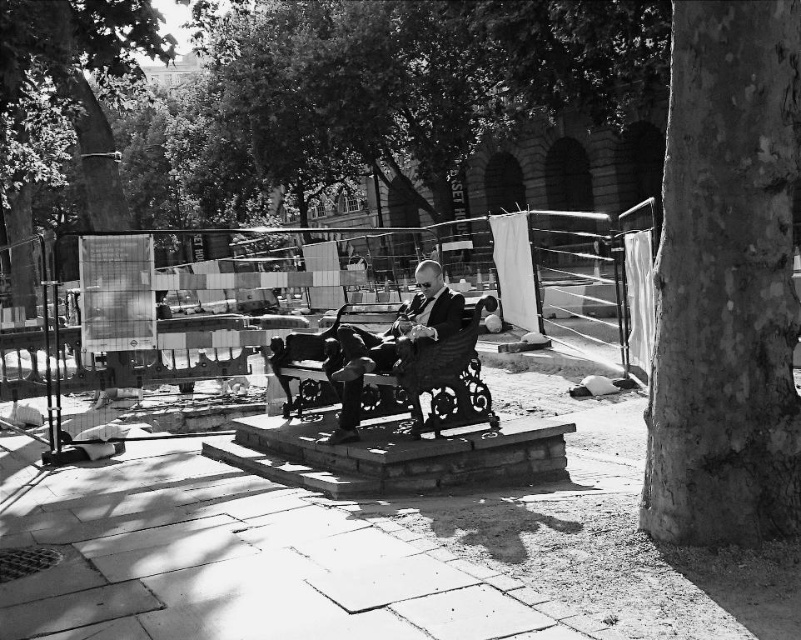
Which of these two, smooth bark tree trunk at right or smooth black suit at center, stands shorter?

Standing shorter between the two is smooth black suit at center.

At what (x,y) coordinates should I click in order to perform the action: click on smooth bark tree trunk at right. Please return your answer as a coordinate pair (x, y). The height and width of the screenshot is (640, 801). Looking at the image, I should click on (727, 280).

Describe the element at coordinates (727, 280) in the screenshot. I see `smooth bark tree trunk at right` at that location.

Identify the location of smooth bark tree trunk at right. (727, 280).